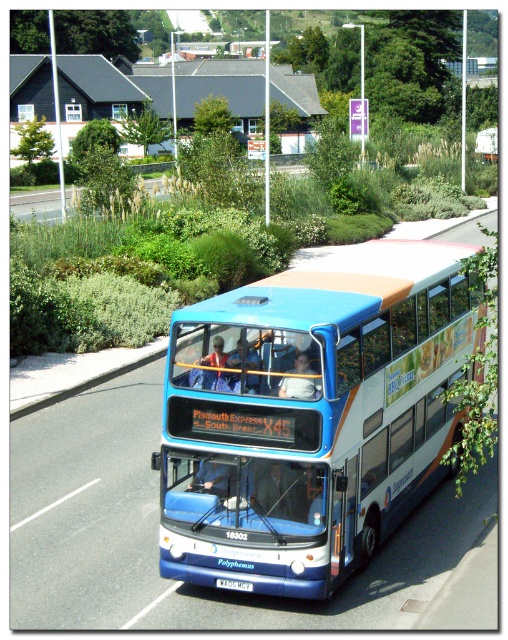
Question: Can you confirm if blue metallic bus at center is wider than white plastic license plate at center?

Choices:
 (A) yes
 (B) no

Answer: (B)

Question: Is blue metallic bus at center to the right of white plastic license plate at center from the viewer's perspective?

Choices:
 (A) no
 (B) yes

Answer: (A)

Question: Which of the following is the farthest from the observer?

Choices:
 (A) blue metallic bus at center
 (B) white plastic license plate at center

Answer: (B)

Question: Which of the following is the farthest from the observer?

Choices:
 (A) (180, 536)
 (B) (248, 584)

Answer: (A)

Question: Can you confirm if blue metallic bus at center is positioned to the left of white plastic license plate at center?

Choices:
 (A) no
 (B) yes

Answer: (B)